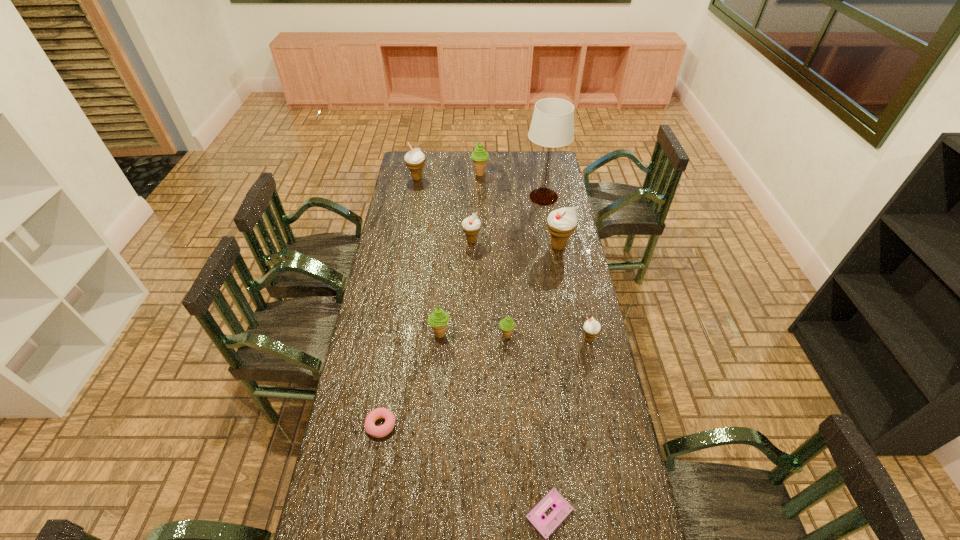
Locate an element on the screen. The height and width of the screenshot is (540, 960). the eighth nearest object is located at coordinates (552, 125).

At what (x,y) coordinates should I click in order to perform the action: click on the tallest object. Please return your answer as a coordinate pair (x, y). Looking at the image, I should click on (552, 125).

At what (x,y) coordinates should I click in order to perform the action: click on the tallest icecream. Please return your answer as a coordinate pair (x, y). Looking at the image, I should click on (561, 223).

Image resolution: width=960 pixels, height=540 pixels. Identify the location of the second tallest object. (561, 223).

Where is `the biggest green icecream`? The width and height of the screenshot is (960, 540). the biggest green icecream is located at coordinates (479, 156).

What are the coordinates of `the farthest green icecream` in the screenshot? It's located at (479, 156).

You are a GUI agent. You are given a task and a screenshot of the screen. Output one action in this format:
    pyautogui.click(x=<x>, y=<y>)
    Task: Click on the leftmost white icecream
    
    Given the screenshot: What is the action you would take?
    pyautogui.click(x=415, y=160)

You are a GUI agent. You are given a task and a screenshot of the screen. Output one action in this format:
    pyautogui.click(x=<x>, y=<y>)
    Task: Click on the leftmost icecream
    This screenshot has width=960, height=540.
    Given the screenshot: What is the action you would take?
    pyautogui.click(x=415, y=160)

Identify the location of the third object from left to right. Image resolution: width=960 pixels, height=540 pixels. (438, 320).

Image resolution: width=960 pixels, height=540 pixels. I want to click on the second biggest green icecream, so click(x=438, y=320).